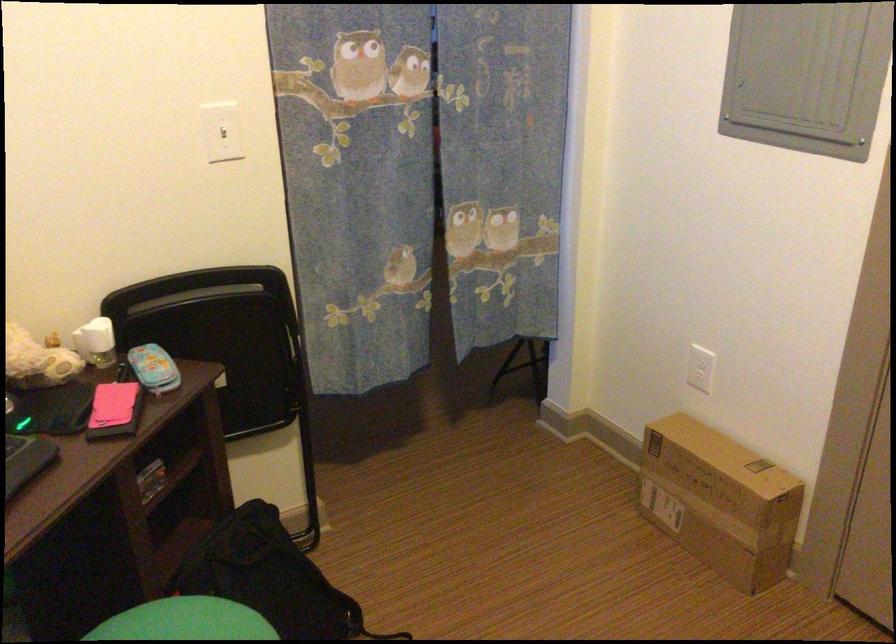
Locate an element on the screen. Image resolution: width=896 pixels, height=644 pixels. white light switch is located at coordinates (222, 131).